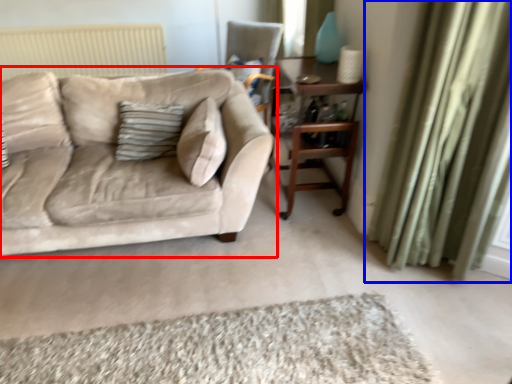
Question: Which object appears farthest to the camera in this image, studio couch (highlighted by a red box) or curtain (highlighted by a blue box)?

Choices:
 (A) studio couch
 (B) curtain

Answer: (A)